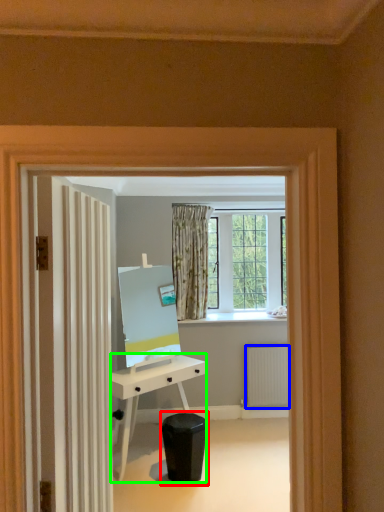
Question: Which is nearer to the swivel chair (highlighted by a red box)? radiator (highlighted by a blue box) or desk (highlighted by a green box).

Choices:
 (A) radiator
 (B) desk

Answer: (B)